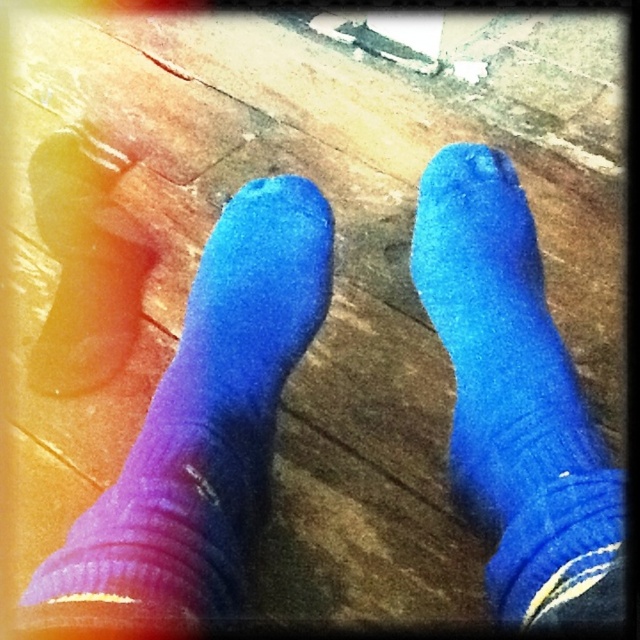
Looking at this image, can you confirm if purple matte socks at lower left is positioned above purple matte sock at lower left?

Actually, purple matte socks at lower left is below purple matte sock at lower left.

Is point (502, 244) in front of point (196, 445)?

No.

Image resolution: width=640 pixels, height=640 pixels. I want to click on purple matte socks at lower left, so click(205, 420).

Who is more forward, (294, 262) or (552, 352)?

Point (552, 352) is more forward.

Who is more distant from viewer, (310, 259) or (480, 420)?

Point (310, 259)

Who is more forward, (x=33, y=600) or (x=534, y=294)?

Point (x=33, y=600) is in front.

Identify the location of purple matte sock at lower left. The width and height of the screenshot is (640, 640). (202, 428).

This screenshot has height=640, width=640. Describe the element at coordinates (205, 420) in the screenshot. I see `purple matte socks at lower left` at that location.

Is point (220, 483) positioned in front of point (496, 557)?

Yes, point (220, 483) is in front of point (496, 557).

This screenshot has width=640, height=640. Identify the location of purple matte socks at lower left. (205, 420).